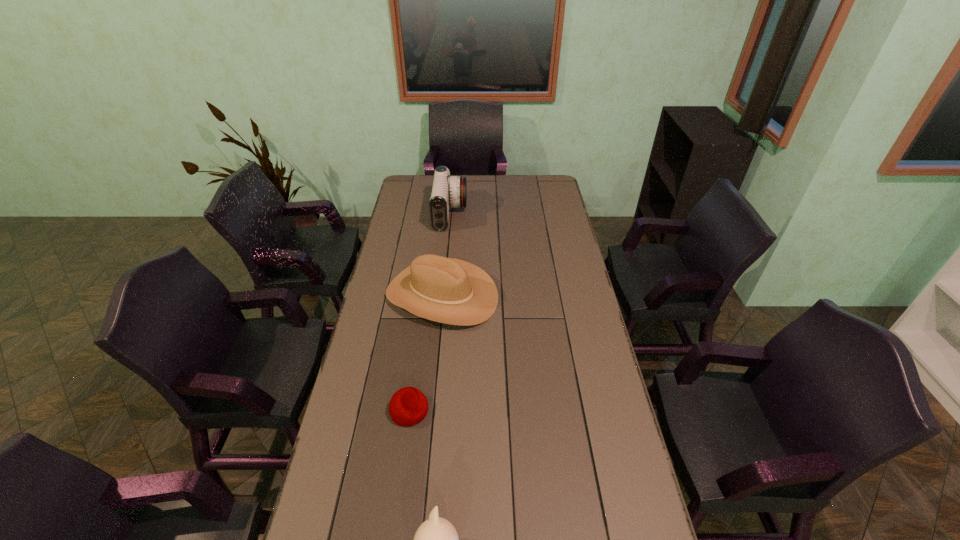
Identify the location of beanbag present at the left edge. Image resolution: width=960 pixels, height=540 pixels. (408, 406).

Identify the location of vacant space at the far edge. This screenshot has width=960, height=540. (468, 190).

The width and height of the screenshot is (960, 540). I want to click on free space at the left edge, so click(340, 411).

What are the coordinates of `vacant area at the right edge of the desktop` in the screenshot? It's located at (574, 321).

Identify the location of vacant region at the far right corner of the desktop. Image resolution: width=960 pixels, height=540 pixels. (554, 184).

Identify the location of free area in between the camcorder and the second farthest object. This screenshot has height=540, width=960. (446, 255).

The image size is (960, 540). Find the location of `free space between the second tallest object and the beanbag`. free space between the second tallest object and the beanbag is located at coordinates (425, 353).

Image resolution: width=960 pixels, height=540 pixels. Find the location of `free space between the second nearest object and the second tallest object`. free space between the second nearest object and the second tallest object is located at coordinates (425, 353).

Identify which object is located as the second nearest to the second shortest object. Please provide its 2D coordinates. Your answer should be formatted as a tuple, i.e. [(x, y)], where the tuple contains the x and y coordinates of a point satisfying the conditions above.

[(446, 290)]

Identify which object is the second closest to the cowboy hat. Please provide its 2D coordinates. Your answer should be formatted as a tuple, i.e. [(x, y)], where the tuple contains the x and y coordinates of a point satisfying the conditions above.

[(408, 406)]